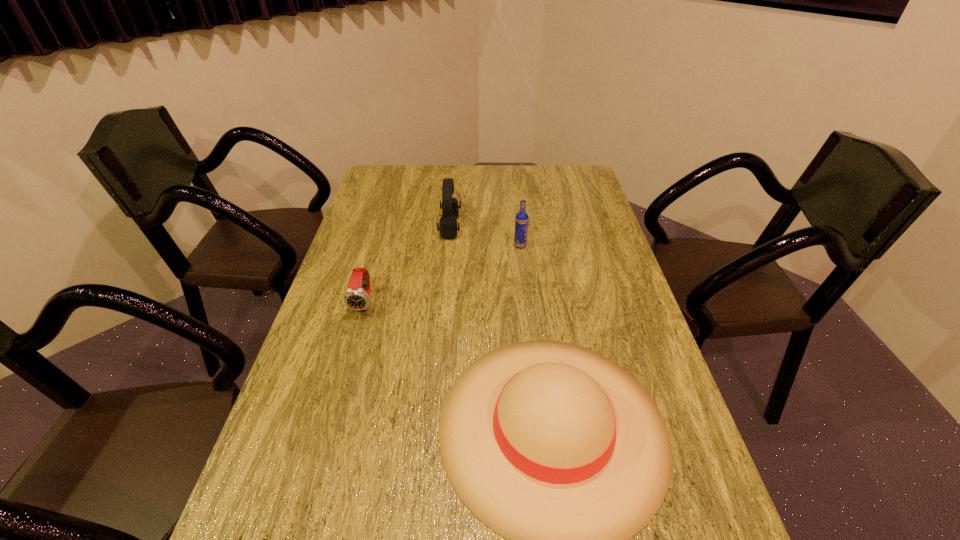
You are a GUI agent. You are given a task and a screenshot of the screen. Output one action in this format:
    pyautogui.click(x=<x>, y=<y>)
    Task: Click on the farthest object
    Image resolution: width=960 pixels, height=540 pixels.
    Given the screenshot: What is the action you would take?
    pyautogui.click(x=448, y=228)

Locate an element on the screen. The width and height of the screenshot is (960, 540). vodka is located at coordinates (521, 222).

This screenshot has width=960, height=540. Identify the location of the second nearest object. (356, 298).

The width and height of the screenshot is (960, 540). What are the coordinates of `watch` in the screenshot? It's located at (356, 298).

Where is `free space located 0.070m on the headband of the farthest object`? This screenshot has height=540, width=960. free space located 0.070m on the headband of the farthest object is located at coordinates pos(481,227).

What are the coordinates of `vacant space situated 0.210m on the right of the vodka` in the screenshot? It's located at (591, 246).

Locate an element on the screen. The width and height of the screenshot is (960, 540). free point located on the face of the third farthest object is located at coordinates (325, 443).

Identify the location of object positioned at the left edge. This screenshot has height=540, width=960. (356, 298).

I want to click on free space at the far edge, so click(x=429, y=183).

The height and width of the screenshot is (540, 960). I want to click on vacant space at the left edge of the desktop, so click(354, 360).